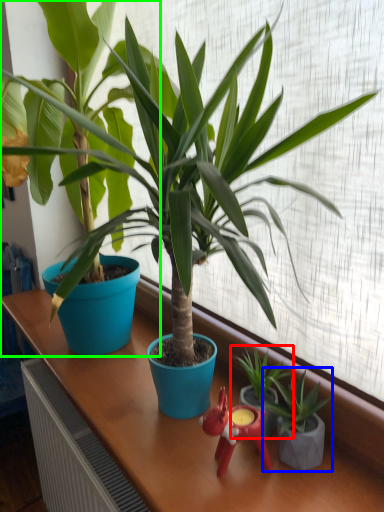
Question: Considering the real-world distances, which object is closest to houseplant (highlighted by a red box)? houseplant (highlighted by a blue box) or houseplant (highlighted by a green box).

Choices:
 (A) houseplant
 (B) houseplant

Answer: (A)